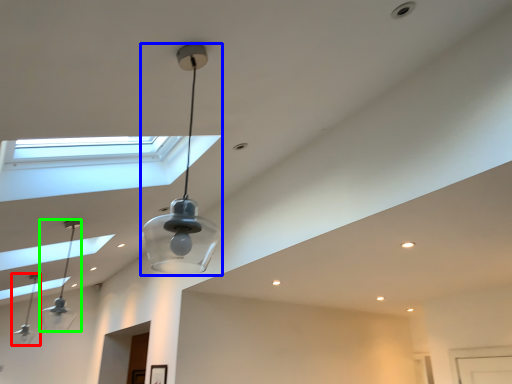
Question: Which object is positioned farthest from lamp (highlighted by a red box)? Select from lamp (highlighted by a blue box) and lamp (highlighted by a green box).

Choices:
 (A) lamp
 (B) lamp

Answer: (A)